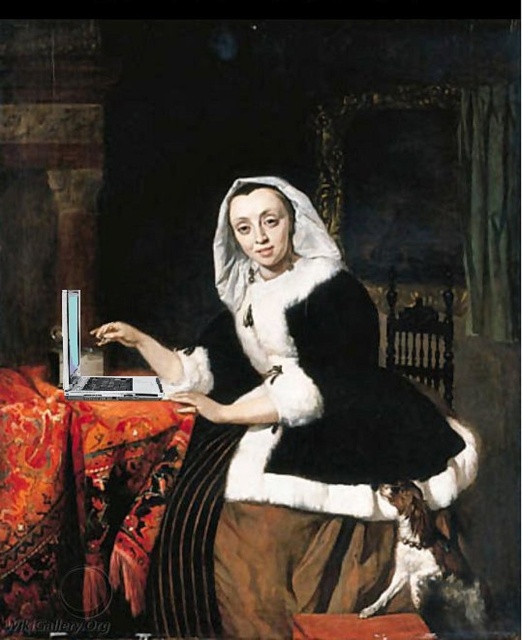
You are an interior designer who needs to place both the metallic silver laptop at left and the silver metallic laptop at center on a shelf that can only hold one of them. Based on their sizes, which laptop should you choose to fit on the shelf?

The metallic silver laptop at left is larger in size than the silver metallic laptop at center, so you should choose the smaller one, the silver metallic laptop at center, to fit on the shelf.

You are an art conservator examining this altered painting. You notice the silky red cloth at lower left and the silver metallic laptop at center. Which object is closer to the viewer?

The silky red cloth at lower left is closer to the viewer because it is in front of the silver metallic laptop at center.